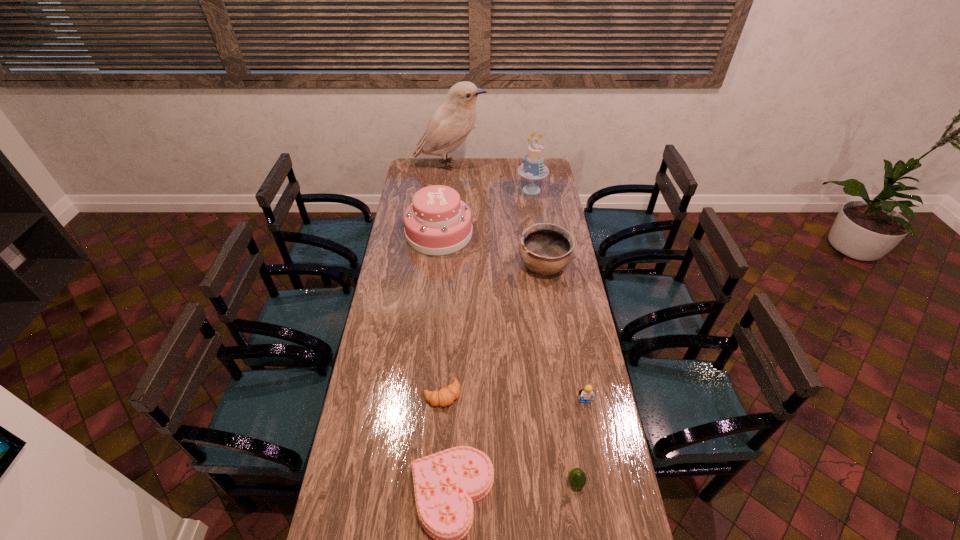
The image size is (960, 540). Identify the location of blank region between the avocado and the pottery. (560, 374).

This screenshot has width=960, height=540. In order to click on vacant space in between the fourth tallest object and the avocado in this screenshot , I will do 560,374.

Identify the location of free space between the second shortest cake and the crescent roll. (441, 314).

I want to click on free space between the tallest object and the Lego, so click(x=517, y=284).

Find the location of a particular element. The width and height of the screenshot is (960, 540). unoccupied area between the sixth shortest object and the Lego is located at coordinates (512, 318).

What are the coordinates of `object that is the third nearest to the shortest object` in the screenshot? It's located at (587, 393).

This screenshot has width=960, height=540. I want to click on object that is the fifth closest one to the tallest cake, so click(587, 393).

At what (x,y) coordinates should I click in order to perform the action: click on the closest cake to the Lego. Please return your answer as a coordinate pair (x, y). Looking at the image, I should click on (446, 484).

Locate an element on the screen. This screenshot has width=960, height=540. cake that is the closest to the tallest object is located at coordinates (533, 168).

Where is `blank space that satisfies the following two spatial constraints: 1. with a ladder on the side of the second farthest object; 2. on the left side of the fifth shortest object`? blank space that satisfies the following two spatial constraints: 1. with a ladder on the side of the second farthest object; 2. on the left side of the fifth shortest object is located at coordinates (542, 266).